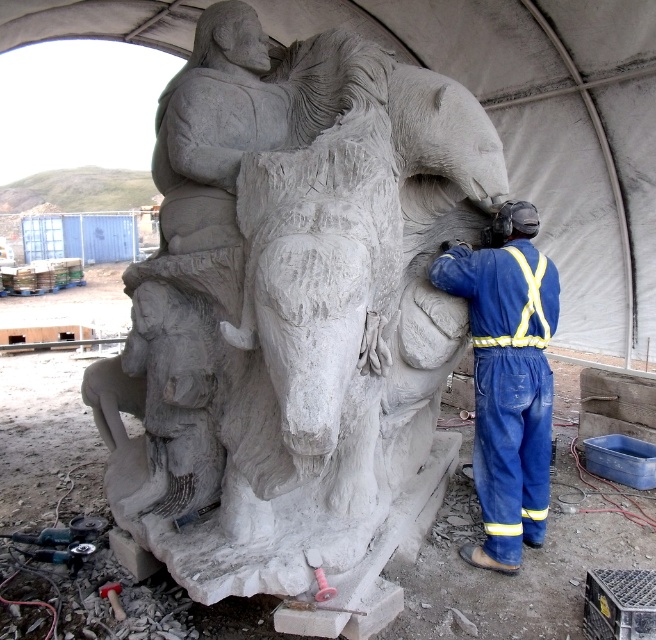
You are standing at the entrance of the temporary shelter. You need to move towards the white stone horse at center. Which direction should you walk to reach it?

The white stone horse at center is located at point (289, 304), so you should walk towards the center of the shelter to reach it.

You are standing at the entrance of the tent and see two points marked in the scene. The first point is at coordinates point [310,64], and the second is at point [510,516]. Which point is closer to you?

Point [310,64] is in front of point [510,516], so the first point is closer to you.

You are a visitor observing the sculptor at work. You notice the white stone horse at center and the blue fabric jumpsuit at right. Which object is nearer to you?

The white stone horse at center is closer to the viewer than the blue fabric jumpsuit at right.